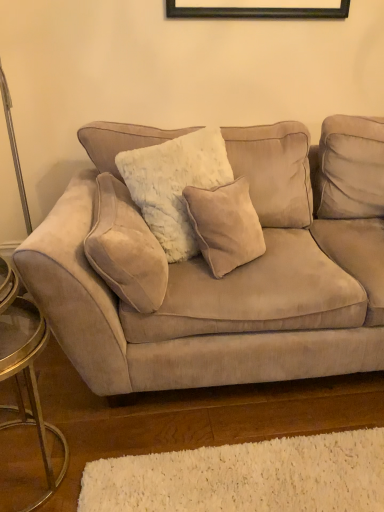
This screenshot has height=512, width=384. Find the location of `free space above white shag rug at lower center (from a real-world perspective)`. free space above white shag rug at lower center (from a real-world perspective) is located at coordinates (258, 472).